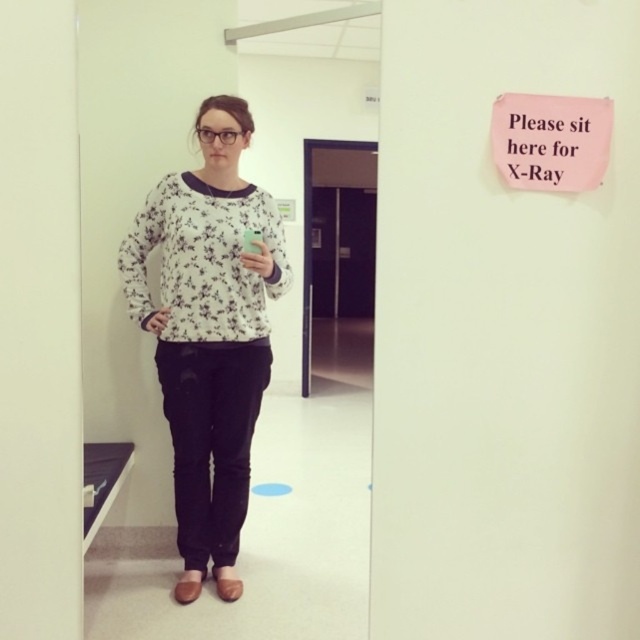
You are a patient in a hospital and need to locate the X Ray room. You see the white floral sweater at center and the pink paper sign at upper right. Which object is closer to you?

The white floral sweater at center is closer to you because the pink paper sign at upper right is behind it.

You are a healthcare worker in the Xray room. You need to locate the white floral sweater at center. Where is it located in the image?

The white floral sweater at center is located at point (209, 332) in the image.

From the picture: You are a photographer adjusting your camera position to capture the best shot of the scene. You notice two points marked in the image. Which point, point 1 at coordinates (168, 296) or point 2 at coordinates (595, 100), is closer to the camera lens?

Point 2 at coordinates (595, 100) is closer to the camera lens because the description states that point (168, 296) is further to the camera than point (595, 100).